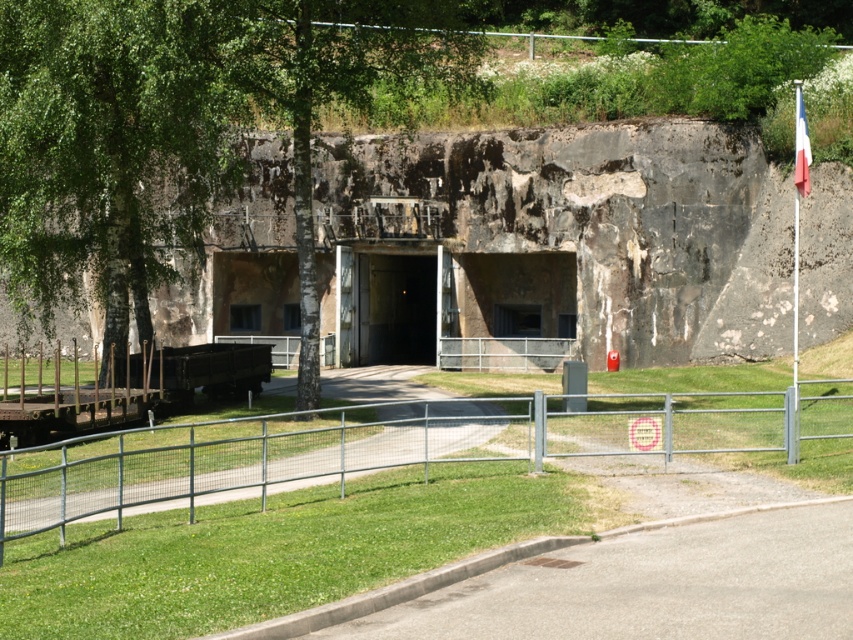
You are a maintenance worker needing to enter the concrete bunker entrance at center. You notice a dark gray concrete tunnel at center nearby. Which structure has a higher ceiling for you to safely pass through with your equipment?

The dark gray concrete tunnel at center has a greater height compared to the concrete bunker entrance at center, so it has a higher ceiling and is safer for passing through with equipment.

You are standing at the entrance of the concrete structure and want to place a small decorative flag exactly at point (395, 445). According to the scene description, where should you place the flag?

The point (395, 445) is on the metal grey fence at lower center, so you should place the flag on the metal grey fence at lower center near the lower central area.